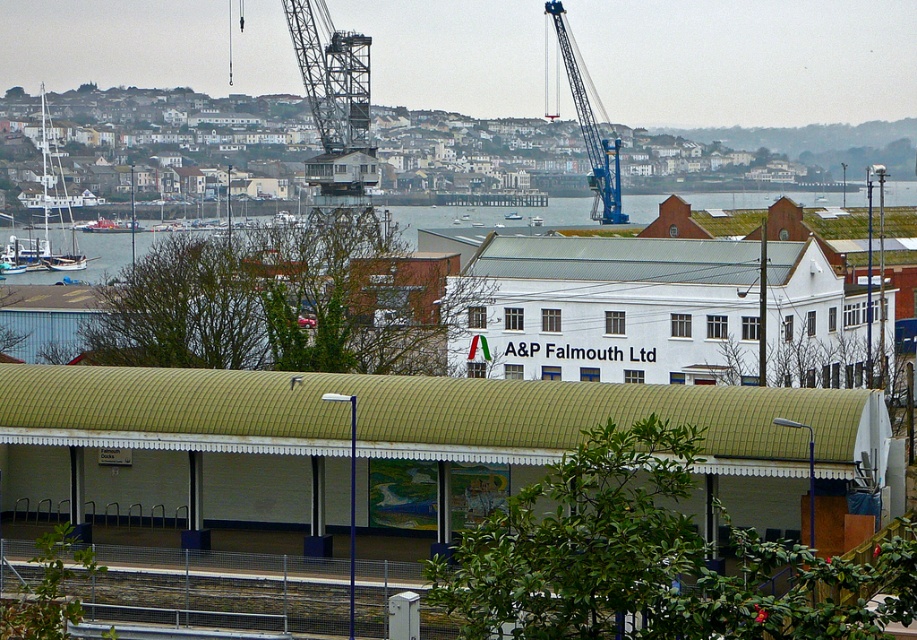
Question: Which object is closer to the camera taking this photo?

Choices:
 (A) blue metallic crane at upper center
 (B) greenish-blue water at center
 (C) white wooden sailboat at upper left

Answer: (B)

Question: Is blue metallic crane at upper center above white wooden boat at center?

Choices:
 (A) no
 (B) yes

Answer: (B)

Question: Which of the following is the closest to the observer?

Choices:
 (A) (594, 211)
 (B) (17, 260)

Answer: (B)

Question: Does white wooden sailboat at upper left appear over white wooden boat at center?

Choices:
 (A) no
 (B) yes

Answer: (A)

Question: Which object appears farthest from the camera in this image?

Choices:
 (A) white wooden sailboat at upper left
 (B) blue metallic crane at upper center
 (C) white wooden boat at center

Answer: (C)

Question: Can you confirm if greenish-blue water at center is smaller than blue metallic crane at upper center?

Choices:
 (A) yes
 (B) no

Answer: (B)